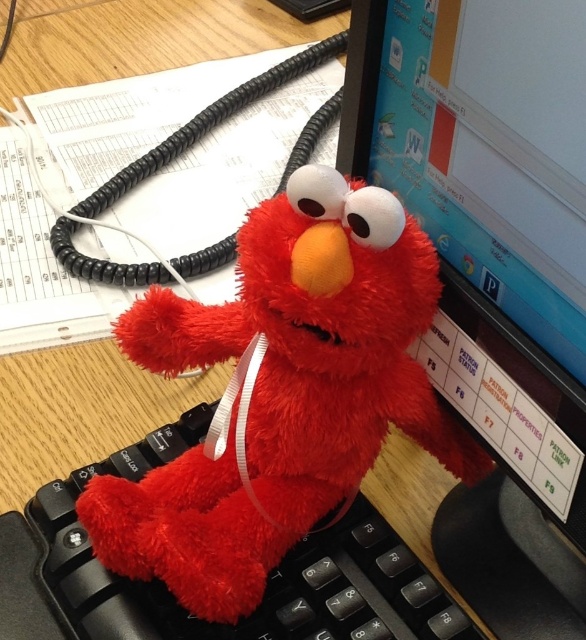
Question: Which is nearer to the fluffy red plush toy at center?

Choices:
 (A) black plastic keyboard at center
 (B) matte plastic monitor at upper right

Answer: (A)

Question: Which point is closer to the camera taking this photo?

Choices:
 (A) (370, 636)
 (B) (479, 515)
 (C) (376, 451)

Answer: (A)

Question: Which point is closer to the camera?

Choices:
 (A) fluffy red plush toy at center
 (B) matte plastic monitor at upper right

Answer: (B)

Question: Is fluffy red plush toy at center further to camera compared to black plastic keyboard at center?

Choices:
 (A) yes
 (B) no

Answer: (B)

Question: Does matte plastic monitor at upper right appear on the left side of fluffy red plush toy at center?

Choices:
 (A) yes
 (B) no

Answer: (B)

Question: Does matte plastic monitor at upper right appear on the right side of black plastic keyboard at center?

Choices:
 (A) yes
 (B) no

Answer: (A)